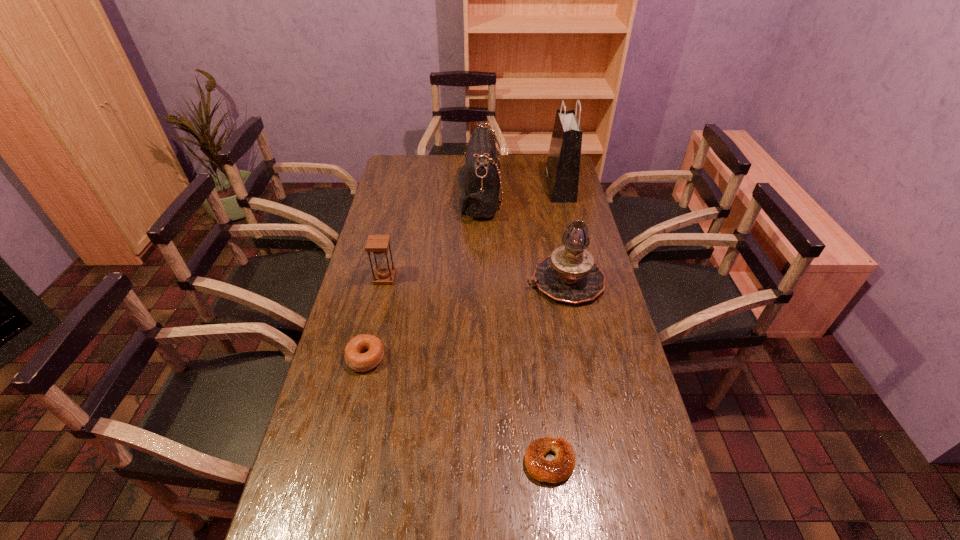
Find the location of a particular element. The height and width of the screenshot is (540, 960). free space located 0.250m on the front with handles of the tallest object is located at coordinates (492, 187).

At what (x,y) coordinates should I click in order to perform the action: click on free space located 0.240m at the front of the third object from left to right with chain and zipper. Please return your answer as a coordinate pair (x, y). The width and height of the screenshot is (960, 540). Looking at the image, I should click on (556, 197).

What are the coordinates of `free space located on the left of the oil lamp` in the screenshot? It's located at (452, 281).

Locate an element on the screen. This screenshot has height=540, width=960. free spot located on the front of the fourth tallest object is located at coordinates (374, 322).

Locate an element on the screen. free location located 0.050m on the back of the fifth tallest object is located at coordinates (372, 330).

Image resolution: width=960 pixels, height=540 pixels. I want to click on free region located on the right of the nearer bagel, so click(644, 462).

Locate an element on the screen. shopping bag located in the far edge section of the desktop is located at coordinates (562, 169).

Locate an element on the screen. This screenshot has width=960, height=540. handbag that is positioned at the far edge is located at coordinates (480, 189).

This screenshot has height=540, width=960. I want to click on hourglass positioned at the left edge, so click(378, 244).

Identify the location of bagel situated at the left edge. (358, 361).